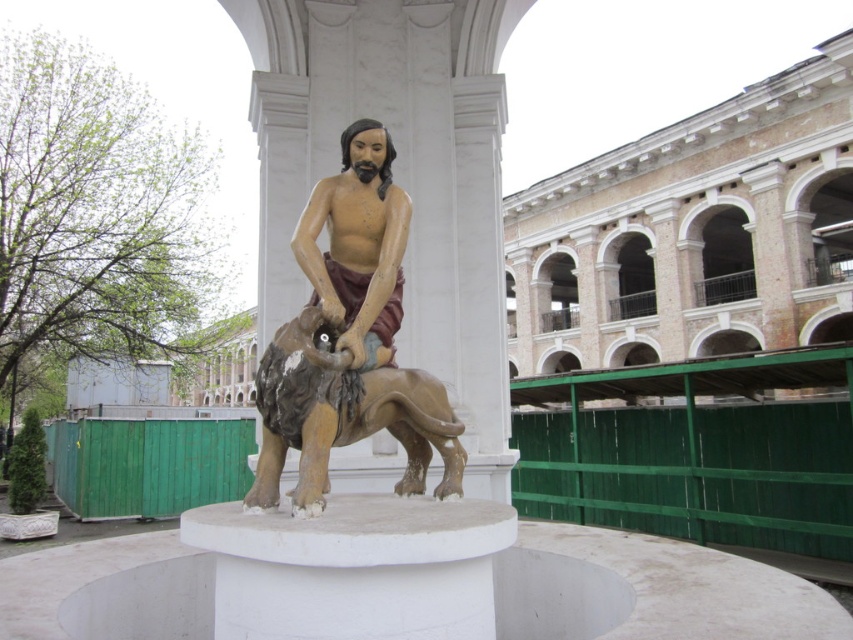
Question: Is wooden statue of man riding animal at center bigger than matte wood statue at center?

Choices:
 (A) yes
 (B) no

Answer: (A)

Question: Which of the following is the closest to the observer?

Choices:
 (A) wooden statue of man riding animal at center
 (B) matte wood statue at center

Answer: (A)

Question: Does wooden statue of man riding animal at center have a smaller size compared to matte wood statue at center?

Choices:
 (A) yes
 (B) no

Answer: (B)

Question: Does wooden statue of man riding animal at center appear on the left side of matte wood statue at center?

Choices:
 (A) no
 (B) yes

Answer: (A)

Question: Among these objects, which one is farthest from the camera?

Choices:
 (A) wooden statue of man riding animal at center
 (B) matte wood statue at center

Answer: (B)

Question: Which of the following is the closest to the observer?

Choices:
 (A) matte wood statue at center
 (B) wooden statue of man riding animal at center

Answer: (B)